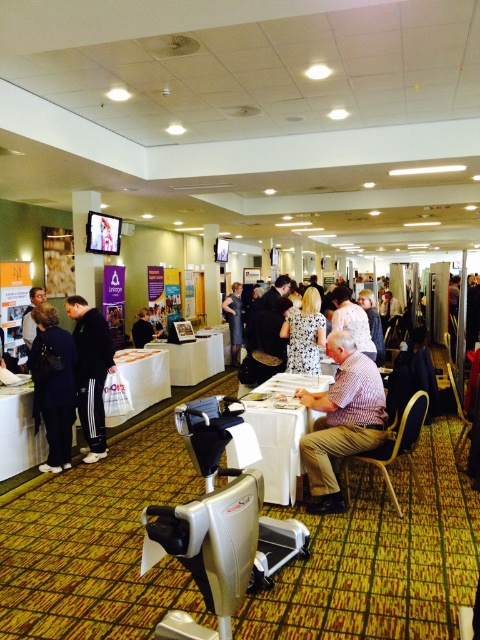
Is white dotted dress at center bigger than white fabric dress at center?

Indeed, white dotted dress at center has a larger size compared to white fabric dress at center.

Does white dotted dress at center have a lesser width compared to white fabric dress at center?

Yes, white dotted dress at center is thinner than white fabric dress at center.

Describe the element at coordinates (304, 333) in the screenshot. I see `white dotted dress at center` at that location.

Identify the location of white dotted dress at center. Image resolution: width=480 pixels, height=640 pixels. (304, 333).

Consider the image. Is white paper bag at center to the left of black fabric jacket at center from the viewer's perspective?

No, white paper bag at center is not to the left of black fabric jacket at center.

Between white paper bag at center and black fabric jacket at center, which one appears on the right side from the viewer's perspective?

white paper bag at center is more to the right.

In order to click on white paper bag at center in this screenshot , I will do `click(142, 380)`.

Identify the location of white paper bag at center. The height and width of the screenshot is (640, 480). (142, 380).

Is plaid shirt at center positioned at the back of white paper bag at center?

No, plaid shirt at center is in front of white paper bag at center.

Can you confirm if plaid shirt at center is taller than white paper bag at center?

Yes, plaid shirt at center is taller than white paper bag at center.

The image size is (480, 640). Identify the location of plaid shirt at center. (342, 420).